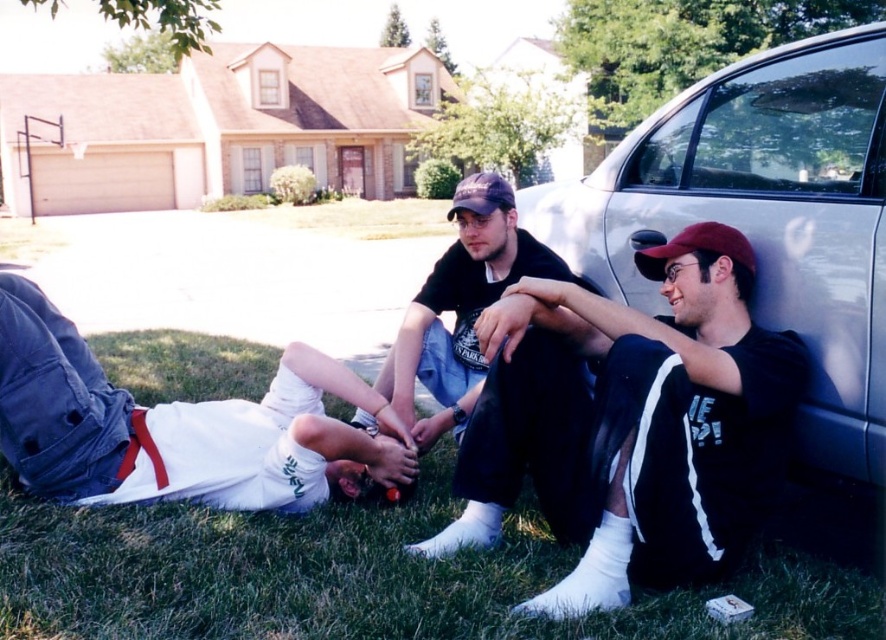
Does white cotton shirt at lower left have a greater width compared to black matte t-shirt at center?

Correct, the width of white cotton shirt at lower left exceeds that of black matte t-shirt at center.

Image resolution: width=886 pixels, height=640 pixels. I want to click on white cotton shirt at lower left, so click(183, 426).

Identify the location of white cotton shirt at lower left. (183, 426).

Between point (646, 547) and point (484, 355), which one is positioned in front?

Point (484, 355) is more forward.

Which is behind, point (670, 266) or point (467, 332)?

Positioned behind is point (467, 332).

You are a GUI agent. You are given a task and a screenshot of the screen. Output one action in this format:
    pyautogui.click(x=<x>, y=<y>)
    Task: Click on the black matte shirt at center
    The height and width of the screenshot is (640, 886).
    Given the screenshot: What is the action you would take?
    pyautogui.click(x=638, y=428)

Is black matte shirt at center shorter than white cotton shirt at lower left?

Incorrect, black matte shirt at center's height does not fall short of white cotton shirt at lower left's.

Can you confirm if black matte shirt at center is wider than white cotton shirt at lower left?

No, black matte shirt at center is not wider than white cotton shirt at lower left.

At what (x,y) coordinates should I click in order to perform the action: click on black matte shirt at center. Please return your answer as a coordinate pair (x, y). Looking at the image, I should click on (638, 428).

You are a GUI agent. You are given a task and a screenshot of the screen. Output one action in this format:
    pyautogui.click(x=<x>, y=<y>)
    Task: Click on the black matte shirt at center
    
    Given the screenshot: What is the action you would take?
    tap(638, 428)